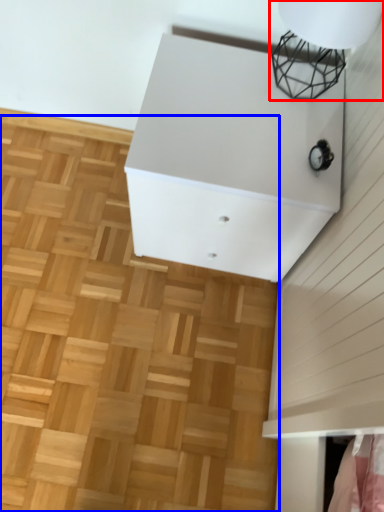
Question: Which object is closer to the camera taking this photo, lamp (highlighted by a red box) or hardwood (highlighted by a blue box)?

Choices:
 (A) lamp
 (B) hardwood

Answer: (A)